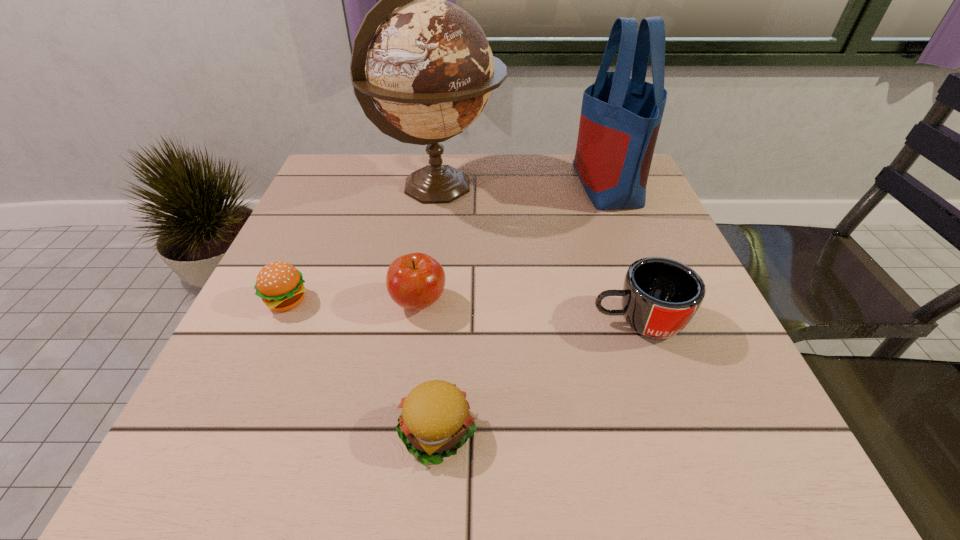
This screenshot has height=540, width=960. Identify the location of free spot between the apple and the mug. (529, 312).

Select which object appears as the closest to the nearer hamburger. Please provide its 2D coordinates. Your answer should be formatted as a tuple, i.e. [(x, y)], where the tuple contains the x and y coordinates of a point satisfying the conditions above.

[(415, 281)]

Image resolution: width=960 pixels, height=540 pixels. Find the location of `object that stands as the fifth closest to the second tallest object`. object that stands as the fifth closest to the second tallest object is located at coordinates (280, 285).

Where is `blank area in the image that satisfies the following two spatial constraints: 1. on the front side of the handbag; 2. on the front of the globe showing Asia`? The width and height of the screenshot is (960, 540). blank area in the image that satisfies the following two spatial constraints: 1. on the front side of the handbag; 2. on the front of the globe showing Asia is located at coordinates (608, 187).

Locate an element on the screen. The width and height of the screenshot is (960, 540). vacant region that satisfies the following two spatial constraints: 1. on the back side of the fifth shortest object; 2. on the left side of the nearest object is located at coordinates (456, 184).

This screenshot has width=960, height=540. Find the location of `vacant space that satisfies the following two spatial constraints: 1. on the front side of the apple; 2. on the left side of the farther hamburger`. vacant space that satisfies the following two spatial constraints: 1. on the front side of the apple; 2. on the left side of the farther hamburger is located at coordinates (285, 302).